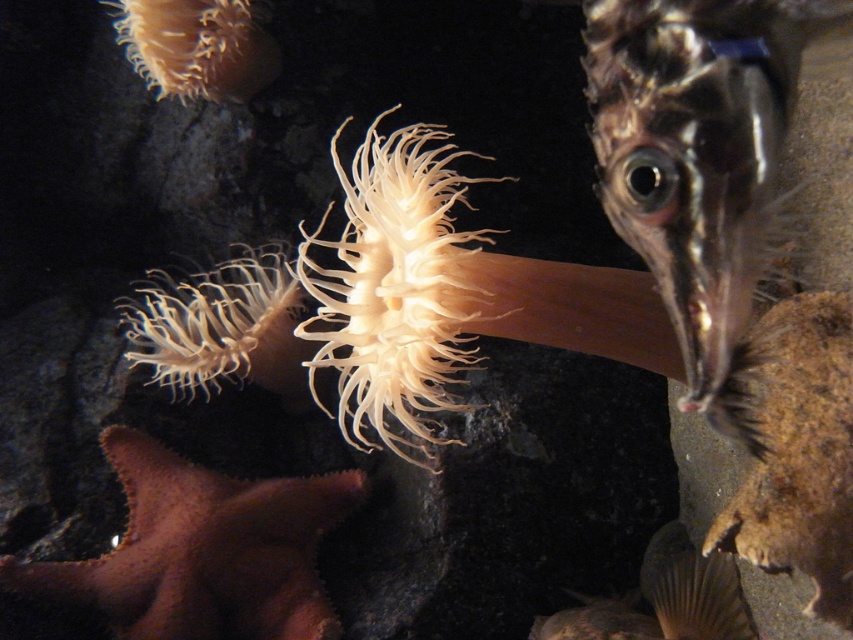
You are a marine biologist observing this underwater scene. You need to determine which object is narrower between the shiny silver fish at center and the translucent white anemone at center. Which one is narrower?

The shiny silver fish at center has a lesser width compared to the translucent white anemone at center, so the shiny silver fish at center is narrower.

You are a scuba diver who wants to take a photo of the shiny silver fish at center and the translucent white anemone at center. Which one is positioned higher in the water column?

The shiny silver fish at center is positioned higher in the water column than the translucent white anemone at center.